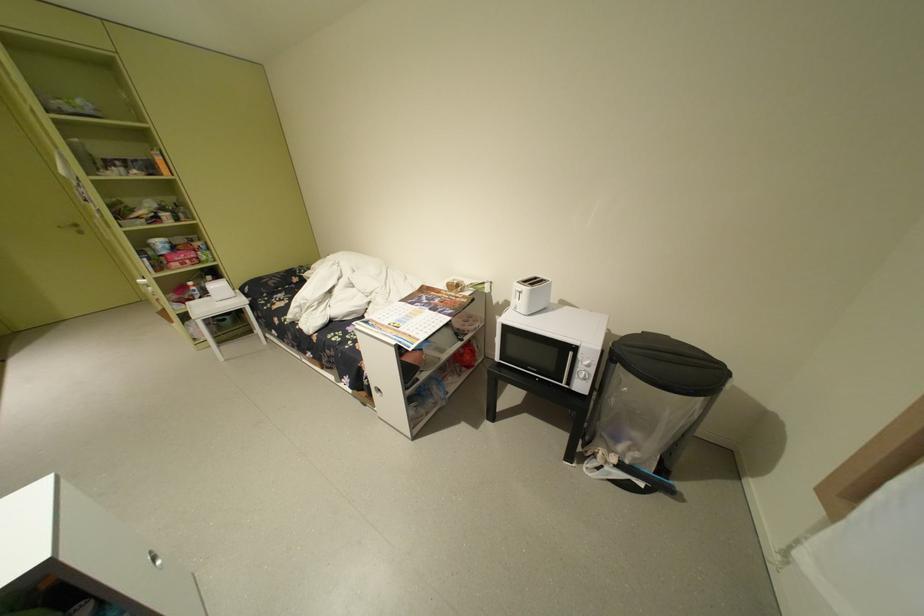
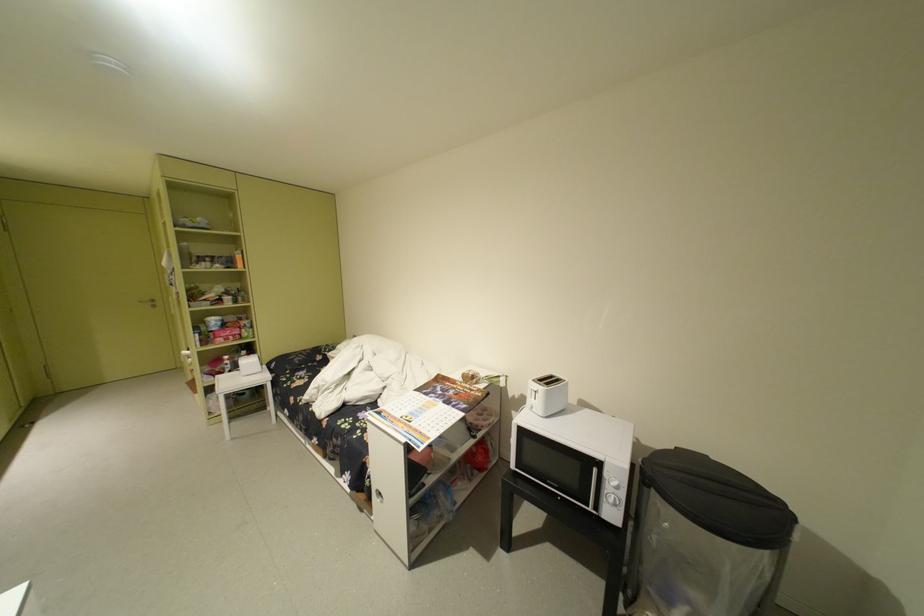
Question: In a continuous first-person perspective shot, in which direction is the camera moving?

Choices:
 (A) Left
 (B) Right
 (C) Forward
 (D) Backward

Answer: (D)